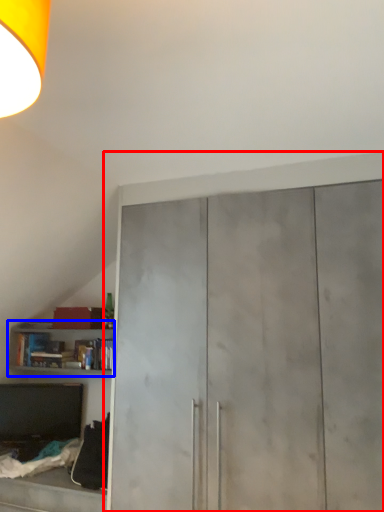
Question: Among these objects, which one is nearest to the camera, cupboard (highlighted by a red box) or cabinetry (highlighted by a blue box)?

Choices:
 (A) cupboard
 (B) cabinetry

Answer: (A)